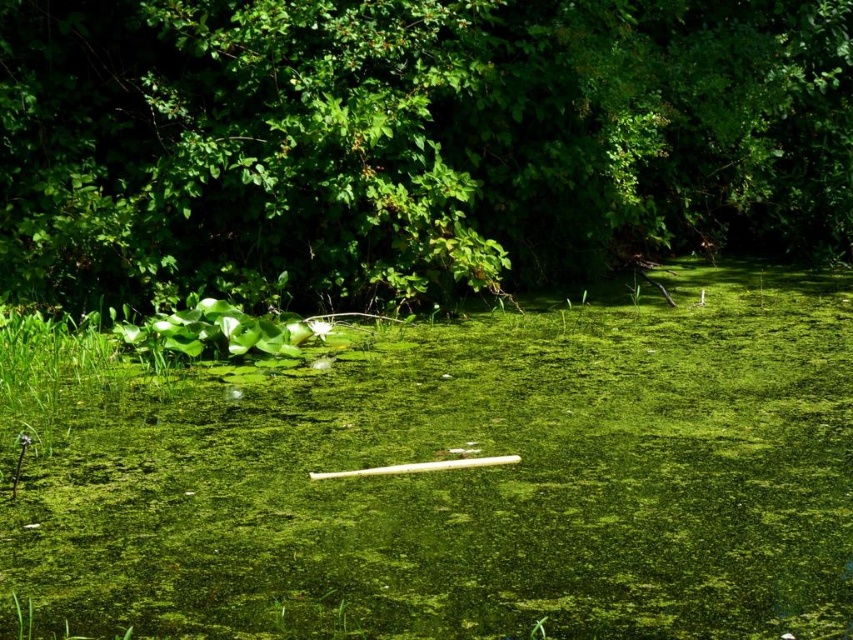
Question: Is green algae-covered water at center further to camera compared to green leafy tree at upper center?

Choices:
 (A) yes
 (B) no

Answer: (B)

Question: In this image, where is green algae-covered water at center located relative to green leafy tree at upper center?

Choices:
 (A) above
 (B) below

Answer: (B)

Question: Can you confirm if green algae-covered water at center is positioned above green leafy tree at upper center?

Choices:
 (A) yes
 (B) no

Answer: (B)

Question: Which point is farther to the camera?

Choices:
 (A) green algae-covered water at center
 (B) green leafy tree at upper center

Answer: (B)

Question: Which point appears farthest from the camera in this image?

Choices:
 (A) (354, 250)
 (B) (122, 449)

Answer: (A)